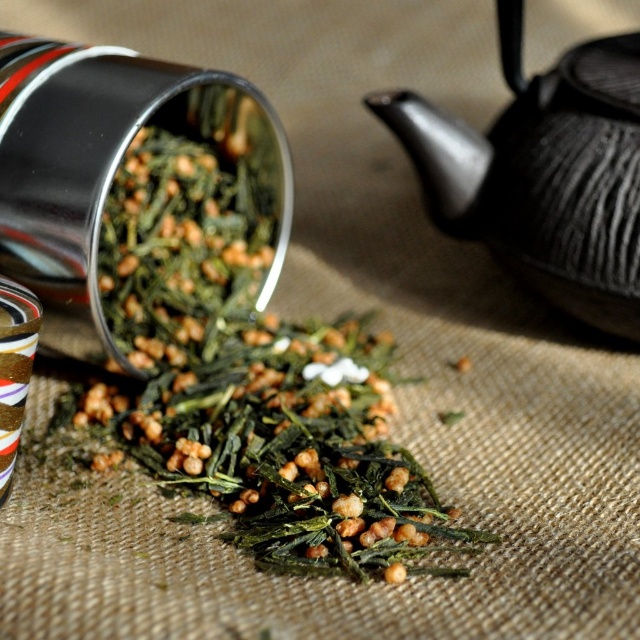
You are a tea preparer who needs to pour water from the black teapot into the metallic cylindrical container. The teapot is full and you want to avoid spilling. Given the distance between the green leafy with small seeds at center and the metallic cylindrical container, is this task feasible?

The distance between the green leafy with small seeds at center and the metallic cylindrical container is 38.04 inches. Since the teapot is full and you need to pour carefully, this distance is manageable to avoid spilling as long as you pour slowly and steadily.

You are setting up a tea station and need to arrange items based on their height. You have the green leafy with small seeds at center and the black textured teapot at upper right. Which item should you place on the lower shelf if you want the taller item to be more visible?

The green leafy with small seeds at center is taller than the black textured teapot at upper right. To make the taller item more visible, place the black textured teapot at upper right on the lower shelf so the taller green leafy with small seeds at center can be placed higher up.